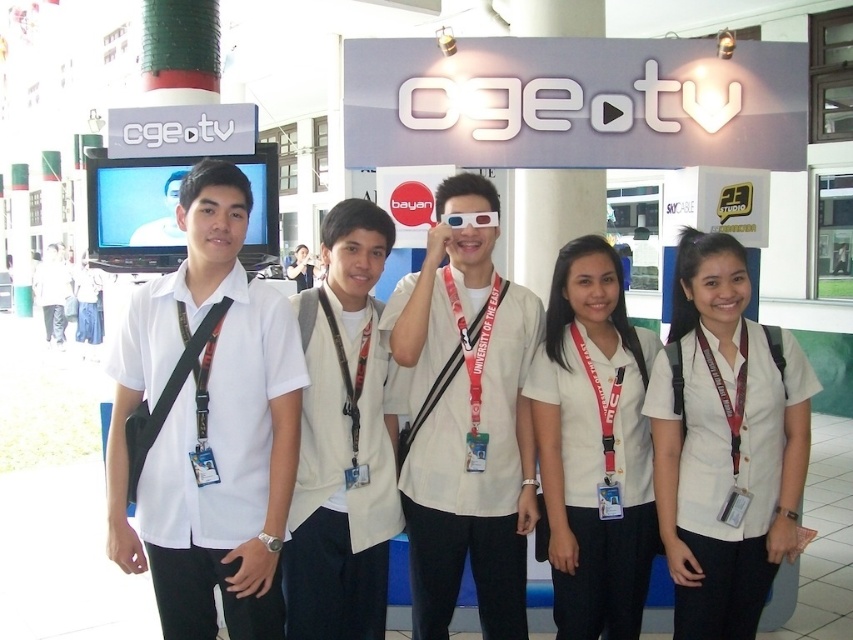
You are standing 10 feet away from the Ogeotv booth. If you move forward 1.2 feet, will you be closer to the point at coordinates point (196,493) than the distance specified in the description?

The point at coordinates point (196,493) is 8.84 feet away from the viewer. If you move forward 1.2 feet from your current position of 10 feet away, your new distance will be 8.8 feet. Since 8.8 feet is less than 8.84 feet, you will be closer to the point at coordinates point (196,493) than the specified distance.

You are organizing a photoshoot and want to ensure that the white matte shirt at left and the white fabric vest at center are visible in the final image. Based on their positions, which clothing item is more likely to be fully visible?

The white matte shirt at left is positioned over the white fabric vest at center, so the white matte shirt at left is more likely to be fully visible.

You are a photographer at the event and need to capture a clear photo of the person in the white fabric shirt at center. Since there is another person in the white matte shirt at center, which one should you focus on to ensure the correct subject is in the foreground?

The white fabric shirt at center is in front of the white matte shirt at center, so you should focus on the white fabric shirt at center to ensure the correct subject is in the foreground.